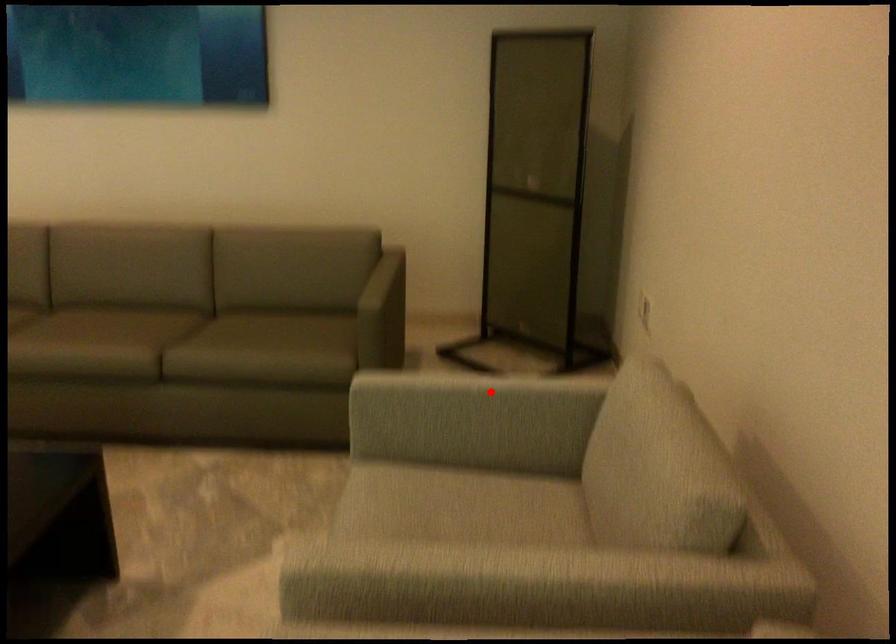
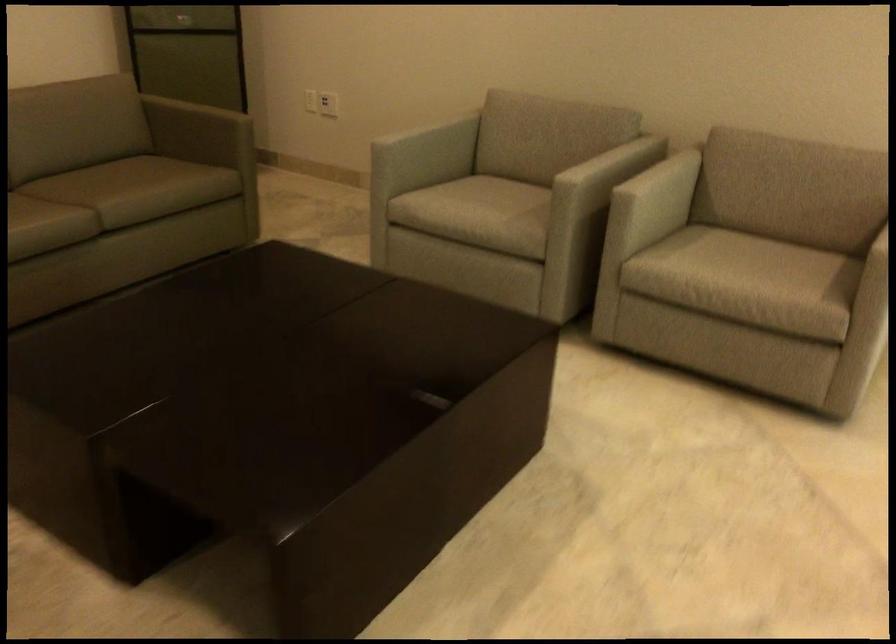
Question: I am providing you with two images of the same scene from different viewpoints. In image1, a red point is highlighted. Considering the same 3D point in image2, which of the following is correct?

Choices:
 (A) It is closer
 (B) It is farther

Answer: (B)